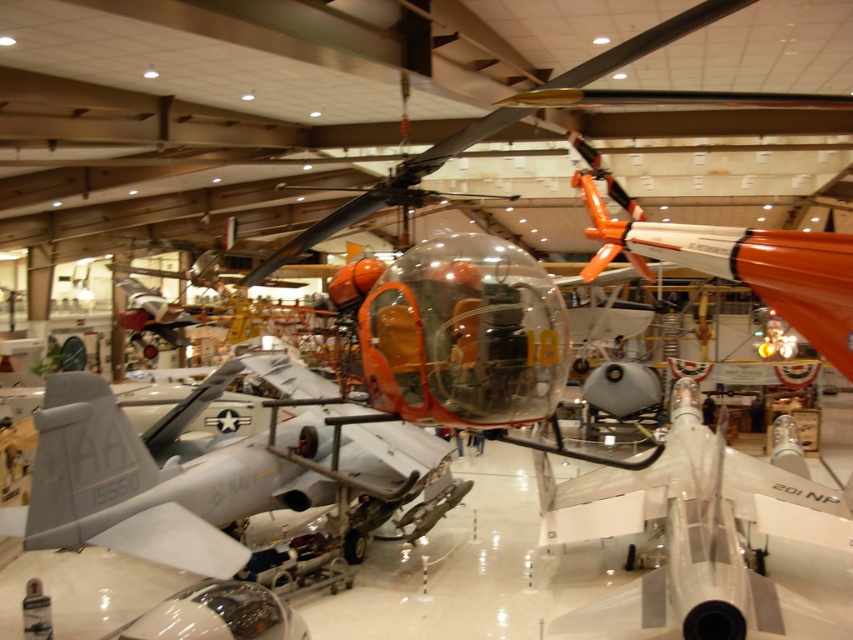
You are standing in the aviation museum and want to take a photo of both the point at coordinates point (213, 577) and the point at coordinates point (740, 614). Since you can only focus on one point at a time, which point should you focus on first to ensure it appears closer in the photo?

You should focus on point (213, 577) first because it is closer to you than point (740, 614), so it will appear closer in the photo.

You are standing in the aviation museum and want to locate the matte gray aircraft at center. According to the coordinates provided, where would you look to find it?

The matte gray aircraft at center is located at coordinates point [218,470].